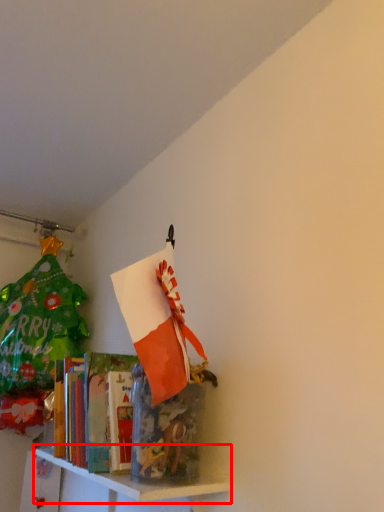
Question: Considering the relative positions of shelf (annotated by the red box) and shelf in the image provided, where is shelf (annotated by the red box) located with respect to the staircase?

Choices:
 (A) left
 (B) right

Answer: (B)